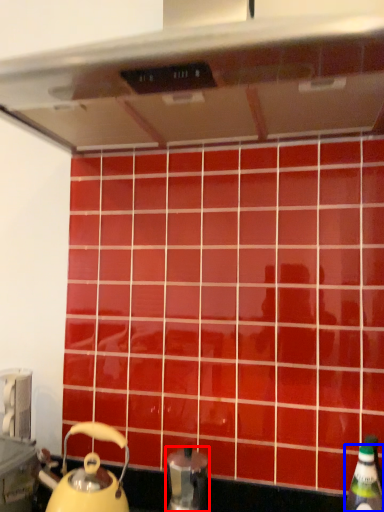
Question: Which point is further to the camera, kitchen appliance (highlighted by a red box) or bottle (highlighted by a blue box)?

Choices:
 (A) kitchen appliance
 (B) bottle

Answer: (A)